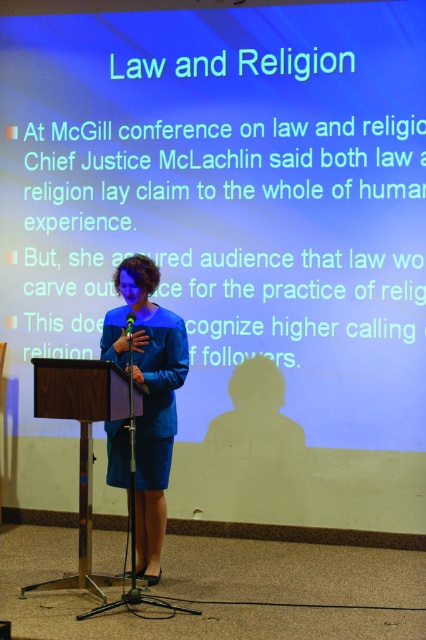
Question: Is matte blue dress at center above wooden podium at center?

Choices:
 (A) no
 (B) yes

Answer: (B)

Question: Is wooden podium at center wider than green plastic microphone at center?

Choices:
 (A) yes
 (B) no

Answer: (A)

Question: Can you confirm if wooden podium at center is positioned below green plastic microphone at center?

Choices:
 (A) no
 (B) yes

Answer: (B)

Question: Estimate the real-world distances between objects in this image. Which object is farther from the green plastic microphone at center?

Choices:
 (A) matte blue dress at center
 (B) wooden podium at center

Answer: (B)

Question: Which point appears closest to the camera in this image?

Choices:
 (A) (146, 538)
 (B) (134, 401)
 (C) (126, 326)

Answer: (C)

Question: Among these points, which one is farthest from the camera?

Choices:
 (A) (169, 349)
 (B) (131, 330)
 (C) (80, 504)

Answer: (A)